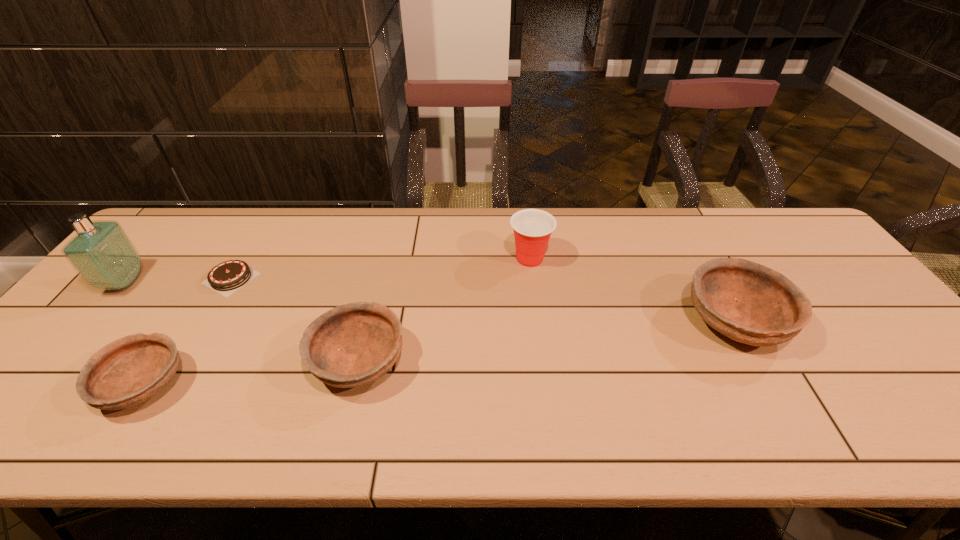
This screenshot has width=960, height=540. In order to click on vacant area that lies between the fourth object from left to right and the leftmost object in this screenshot , I will do `click(242, 322)`.

This screenshot has width=960, height=540. In order to click on vacant space that's between the shortest bowl and the second bowl from left to right in this screenshot , I will do `click(252, 374)`.

Identify which object is the closest to the second tallest bowl. Please provide its 2D coordinates. Your answer should be formatted as a tuple, i.e. [(x, y)], where the tuple contains the x and y coordinates of a point satisfying the conditions above.

[(230, 275)]

Where is `object that stands as the fifth closest to the cup`? This screenshot has height=540, width=960. object that stands as the fifth closest to the cup is located at coordinates (103, 255).

Locate an element on the screen. The height and width of the screenshot is (540, 960). bowl that is the second closest one to the leftmost object is located at coordinates (351, 345).

Image resolution: width=960 pixels, height=540 pixels. Find the location of `bowl that is the second nearest to the rightmost bowl`. bowl that is the second nearest to the rightmost bowl is located at coordinates (128, 371).

I want to click on free spot that satisfies the following two spatial constraints: 1. on the front side of the second object from right to left; 2. on the front label of the tallest object, so click(x=533, y=282).

Image resolution: width=960 pixels, height=540 pixels. Identify the location of free location that satisfies the following two spatial constraints: 1. on the front side of the second object from right to left; 2. on the left side of the rightmost bowl. (538, 320).

What are the coordinates of `free space that satisfies the following two spatial constraints: 1. on the front label of the leftmost object; 2. on the back side of the second bowl from right to left` in the screenshot? It's located at (57, 362).

You are a GUI agent. You are given a task and a screenshot of the screen. Output one action in this format:
    pyautogui.click(x=<x>, y=<y>)
    Task: Click on the vacant space that satisfies the following two spatial constraints: 1. on the front label of the rightmost bowl; 2. on the left side of the leftmost object
    The image size is (960, 540).
    Given the screenshot: What is the action you would take?
    pyautogui.click(x=92, y=320)